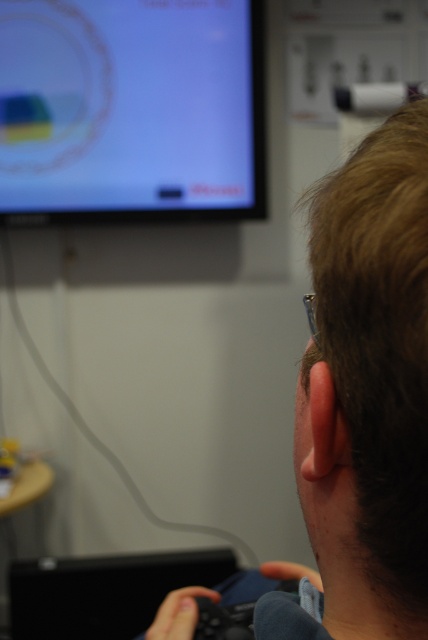
Question: Does matte plastic monitor at upper left appear under brown hair at upper right?

Choices:
 (A) no
 (B) yes

Answer: (A)

Question: In this image, where is matte plastic monitor at upper left located relative to brown hair at upper right?

Choices:
 (A) right
 (B) left

Answer: (B)

Question: Which of the following is the closest to the observer?

Choices:
 (A) (55, 204)
 (B) (413, 212)

Answer: (B)

Question: From the image, what is the correct spatial relationship of matte plastic monitor at upper left in relation to brown hair at upper right?

Choices:
 (A) left
 (B) right

Answer: (A)

Question: Which of the following is the farthest from the observer?

Choices:
 (A) (225, 113)
 (B) (400, 563)

Answer: (A)